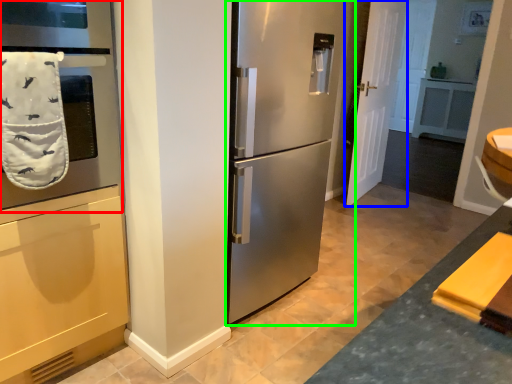
Question: Which is nearer to the oven (highlighted by a red box)? door (highlighted by a blue box) or refrigerator (highlighted by a green box).

Choices:
 (A) door
 (B) refrigerator

Answer: (B)